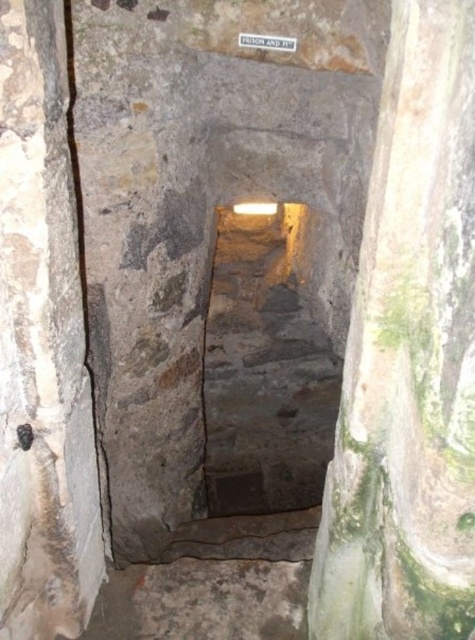
Question: Which point is closer to the camera?

Choices:
 (A) gray stone pillar at left
 (B) green mossy stone pillar at center

Answer: (B)

Question: Can you confirm if green mossy stone pillar at center is positioned below gray stone pillar at left?

Choices:
 (A) yes
 (B) no

Answer: (A)

Question: Which of the following is the closest to the observer?

Choices:
 (A) (369, 326)
 (B) (6, 477)

Answer: (A)

Question: Can you confirm if green mossy stone pillar at center is positioned to the left of gray stone pillar at left?

Choices:
 (A) yes
 (B) no

Answer: (B)

Question: Is green mossy stone pillar at center closer to camera compared to gray stone pillar at left?

Choices:
 (A) yes
 (B) no

Answer: (A)